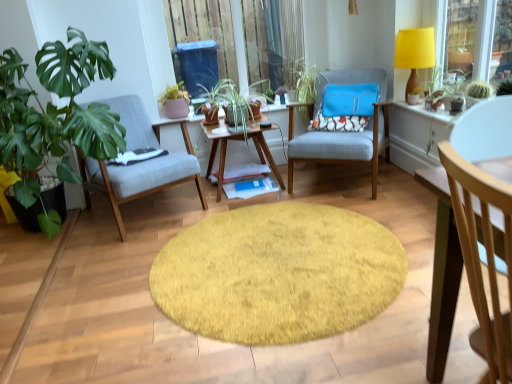
Question: Should I look upward or downward to see light wood chair at right, placed as the third chair when sorted from left to right?

Choices:
 (A) up
 (B) down

Answer: (B)

Question: Is transparent plastic window screen at upper center to the right of matte gray chair at left, the second chair viewed from the front, from the viewer's perspective?

Choices:
 (A) yes
 (B) no

Answer: (A)

Question: Is transparent plastic window screen at upper center placed right next to matte gray chair at left, placed as the 3th chair when sorted from right to left?

Choices:
 (A) no
 (B) yes

Answer: (A)

Question: Is transparent plastic window screen at upper center taller than matte gray chair at left, the second chair viewed from the front?

Choices:
 (A) yes
 (B) no

Answer: (A)

Question: From a real-world perspective, does transparent plastic window screen at upper center sit lower than matte gray chair at left, placed as the 3th chair when sorted from right to left?

Choices:
 (A) yes
 (B) no

Answer: (B)

Question: Is transparent plastic window screen at upper center outside matte gray chair at left, the first chair in the left-to-right sequence?

Choices:
 (A) yes
 (B) no

Answer: (A)

Question: Can you confirm if transparent plastic window screen at upper center is thinner than matte gray chair at left, the second chair viewed from the front?

Choices:
 (A) yes
 (B) no

Answer: (A)

Question: From a real-world perspective, is green leafy plant at center located higher than yellow shaggy rug at center?

Choices:
 (A) yes
 (B) no

Answer: (A)

Question: Does green leafy plant at center appear on the left side of yellow shaggy rug at center?

Choices:
 (A) yes
 (B) no

Answer: (B)

Question: From a real-world perspective, is green leafy plant at center below yellow shaggy rug at center?

Choices:
 (A) yes
 (B) no

Answer: (B)

Question: From the image's perspective, is green leafy plant at center over yellow shaggy rug at center?

Choices:
 (A) no
 (B) yes

Answer: (B)

Question: Can you confirm if green leafy plant at center is thinner than yellow shaggy rug at center?

Choices:
 (A) no
 (B) yes

Answer: (B)

Question: Can you confirm if green leafy plant at center is bigger than yellow shaggy rug at center?

Choices:
 (A) no
 (B) yes

Answer: (B)

Question: Is matte gray chair at left, the second chair viewed from the front, completely or partially outside of light wood chair at right, marked as the 1th chair in a right-to-left arrangement?

Choices:
 (A) yes
 (B) no

Answer: (A)